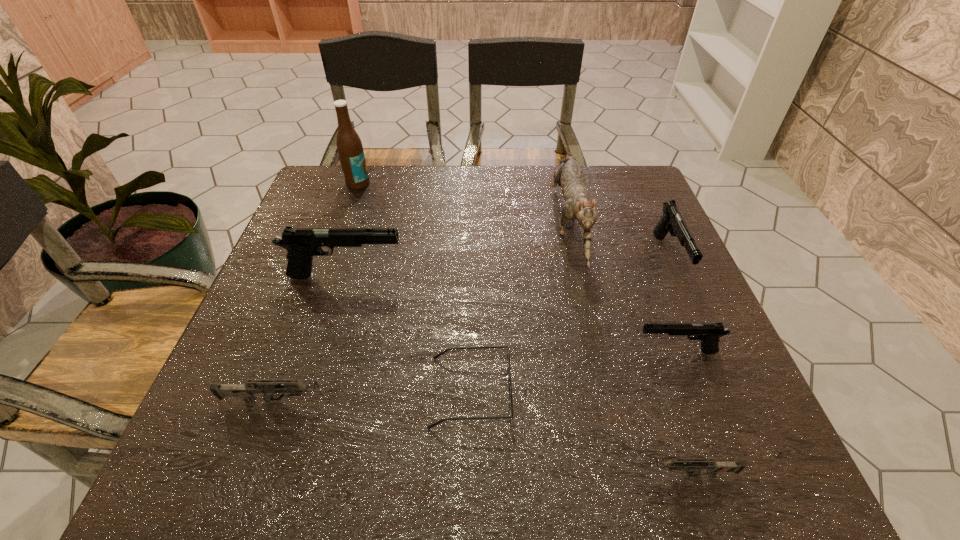
At what (x,y) coordinates should I click in order to perform the action: click on empty location between the second tallest gun and the fifth tallest object. Please return your answer as a coordinate pair (x, y). Looking at the image, I should click on (673, 305).

At what (x,y) coordinates should I click in order to perform the action: click on free space between the nearest object and the cat. Please return your answer as a coordinate pair (x, y). The height and width of the screenshot is (540, 960). Looking at the image, I should click on (626, 348).

The height and width of the screenshot is (540, 960). I want to click on empty location between the second tallest object and the second tallest gun, so click(x=618, y=240).

At what (x,y) coordinates should I click in order to perform the action: click on free spot between the nearest object and the third shortest object. Please return your answer as a coordinate pair (x, y). Looking at the image, I should click on (483, 437).

This screenshot has width=960, height=540. Identify the location of empty space that is in between the fourth farthest gun and the sixth shortest object. (313, 339).

Where is `free space that is in between the fifth shortest object and the tallest object`? free space that is in between the fifth shortest object and the tallest object is located at coordinates (514, 221).

Where is `free spot between the seventh shortest object and the fourth tallest object`? free spot between the seventh shortest object and the fourth tallest object is located at coordinates (618, 240).

Locate an element on the screen. object that is the fifth closest to the spectacles is located at coordinates (569, 176).

Locate an element on the screen. This screenshot has width=960, height=540. the fifth closest object to the fourth shortest gun is located at coordinates (302, 244).

Identify which gun is the fifth nearest to the fourth object from left to right. Please provide its 2D coordinates. Your answer should be formatted as a tuple, i.e. [(x, y)], where the tuple contains the x and y coordinates of a point satisfying the conditions above.

[(672, 221)]